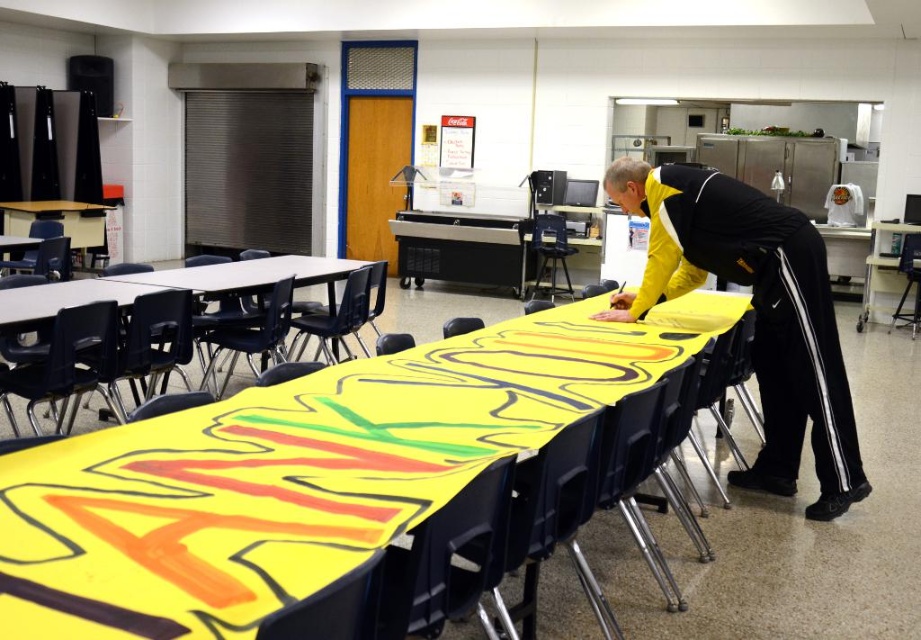
Question: Which of the following is the farthest from the observer?

Choices:
 (A) yellow paper at center
 (B) yellow athletic wear at center
 (C) matte plastic table at center

Answer: (C)

Question: Considering the relative positions of yellow paper at center and matte plastic table at center in the image provided, where is yellow paper at center located with respect to matte plastic table at center?

Choices:
 (A) above
 (B) below

Answer: (B)

Question: Which object is closer to the camera taking this photo?

Choices:
 (A) matte plastic table at center
 (B) yellow paper at center
 (C) yellow athletic wear at center

Answer: (B)

Question: Can you confirm if yellow athletic wear at center is smaller than matte plastic table at center?

Choices:
 (A) yes
 (B) no

Answer: (A)

Question: Which of the following is the closest to the observer?

Choices:
 (A) yellow paper at center
 (B) matte plastic table at center

Answer: (A)

Question: Is yellow athletic wear at center closer to camera compared to matte plastic table at center?

Choices:
 (A) no
 (B) yes

Answer: (B)